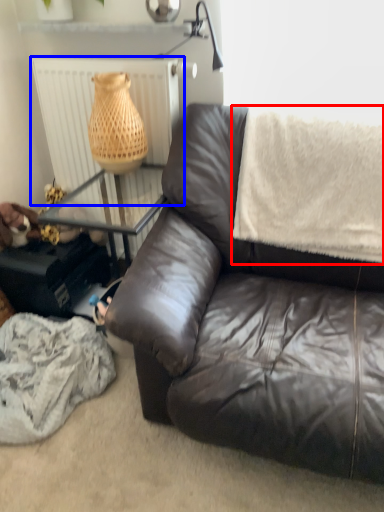
Question: Which object appears closest to the camera in this image, blanket (highlighted by a red box) or radiator (highlighted by a blue box)?

Choices:
 (A) blanket
 (B) radiator

Answer: (A)